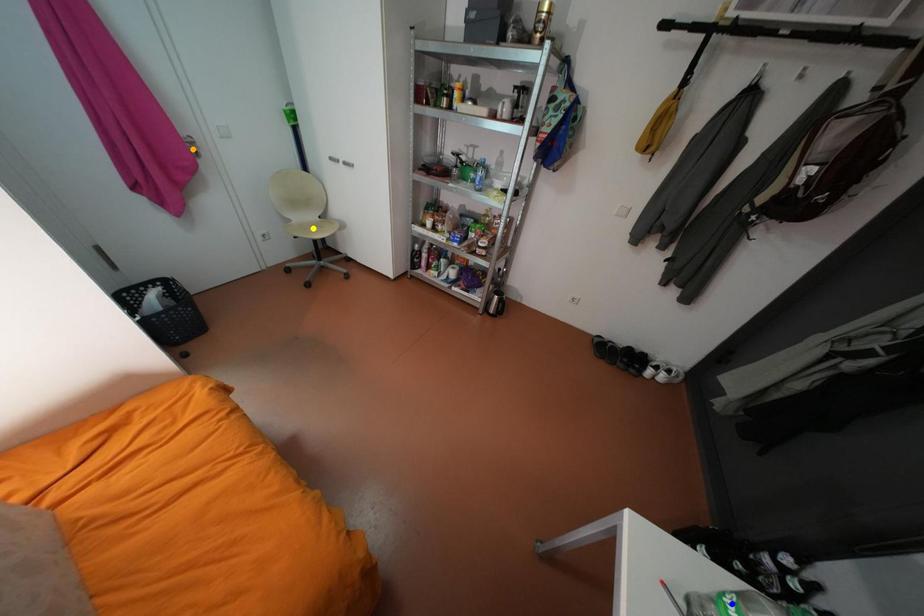
Order these from nearest to farthest:
A) orange point
B) blue point
C) yellow point

blue point, orange point, yellow point